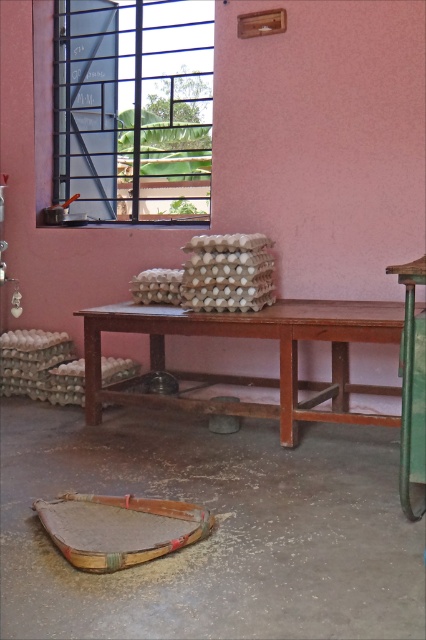
Question: Which point is closer to the camera taking this photo?

Choices:
 (A) (85, 508)
 (B) (405, 508)
 (C) (195, 100)
 (D) (310, 390)

Answer: (B)

Question: Which object appears farthest from the camera in this image?

Choices:
 (A) green plastic stool at lower right
 (B) wooden tray at lower center
 (C) metallic grid window at upper left
 (D) brown wooden picnic table at center

Answer: (C)

Question: Can you confirm if metallic grid window at upper left is positioned to the right of wooden tray at lower center?

Choices:
 (A) yes
 (B) no

Answer: (B)

Question: Is metallic grid window at upper left behind green plastic stool at lower right?

Choices:
 (A) no
 (B) yes

Answer: (B)

Question: Does metallic grid window at upper left appear on the right side of wooden tray at lower center?

Choices:
 (A) yes
 (B) no

Answer: (B)

Question: Which point is closer to the camera?

Choices:
 (A) green plastic stool at lower right
 (B) metallic grid window at upper left
 (C) wooden tray at lower center
 (D) brown wooden picnic table at center

Answer: (C)